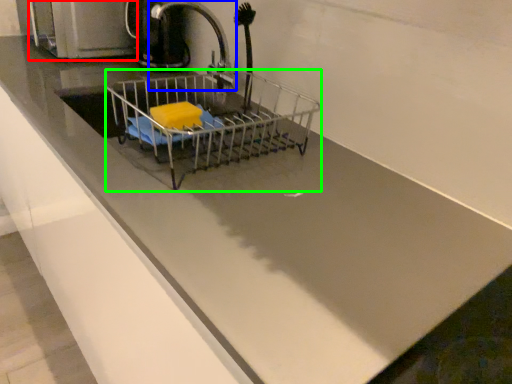
Question: Which is nearer to the appliance (highlighted by a red box)? tap (highlighted by a blue box) or shopping cart (highlighted by a green box).

Choices:
 (A) tap
 (B) shopping cart

Answer: (A)